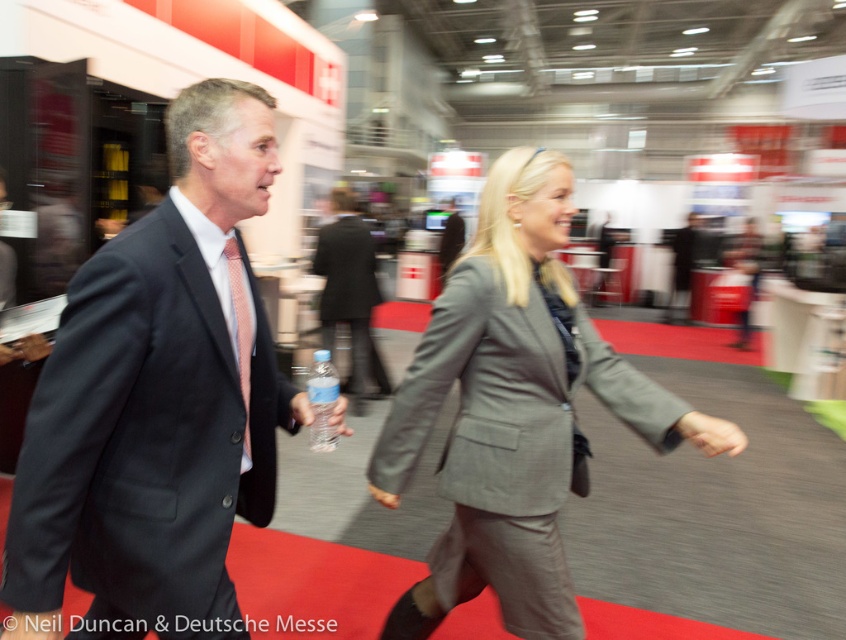
Can you confirm if dark gray suit at center is shorter than clear plastic bottle at center?

Correct, dark gray suit at center is not as tall as clear plastic bottle at center.

Does dark gray suit at center have a larger size compared to clear plastic bottle at center?

Actually, dark gray suit at center might be smaller than clear plastic bottle at center.

Describe the element at coordinates (157, 401) in the screenshot. I see `dark gray suit at center` at that location.

What are the coordinates of `dark gray suit at center` in the screenshot? It's located at (157, 401).

What do you see at coordinates (514, 410) in the screenshot?
I see `gray fabric suit at center` at bounding box center [514, 410].

Does gray fabric suit at center have a greater width compared to clear plastic bottle at center?

Indeed, gray fabric suit at center has a greater width compared to clear plastic bottle at center.

Where is `gray fabric suit at center`? The image size is (846, 640). gray fabric suit at center is located at coordinates (514, 410).

Can you confirm if dark gray suit at center is shorter than gray fabric suit at center?

Correct, dark gray suit at center is not as tall as gray fabric suit at center.

Who is positioned more to the left, dark gray suit at center or gray fabric suit at center?

Positioned to the left is dark gray suit at center.

Between point (233, 376) and point (674, 438), which one is positioned in front?

Point (233, 376) is more forward.

This screenshot has width=846, height=640. What are the coordinates of `dark gray suit at center` in the screenshot? It's located at (157, 401).